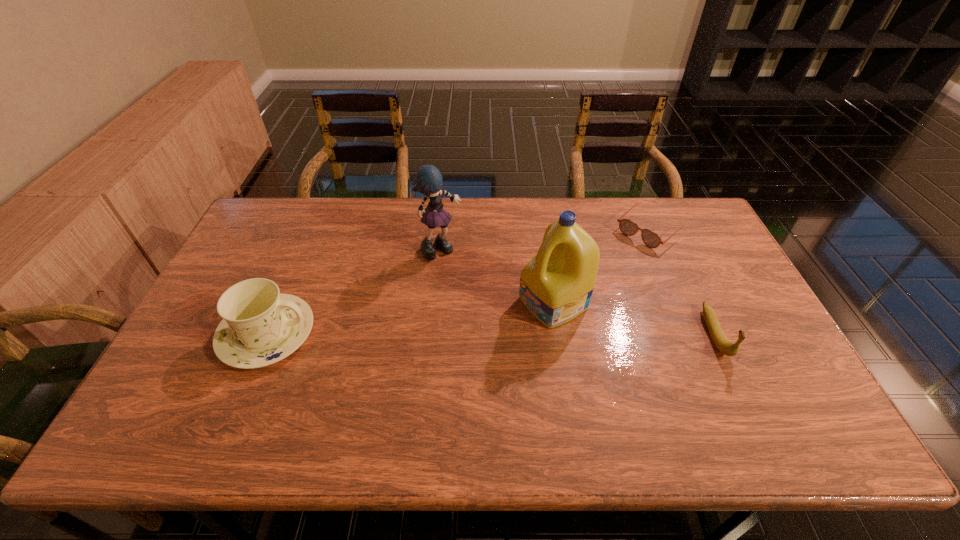
Where is `free region located 0.070m on the front-facing side of the sunglasses`? free region located 0.070m on the front-facing side of the sunglasses is located at coordinates (619, 256).

You are a GUI agent. You are given a task and a screenshot of the screen. Output one action in this format:
    pyautogui.click(x=<x>, y=<y>)
    Task: Click on the vacant region located 0.340m on the label of the third object from left to right
    The image size is (960, 540).
    Given the screenshot: What is the action you would take?
    pyautogui.click(x=418, y=373)

The height and width of the screenshot is (540, 960). I want to click on vacant space located on the label of the third object from left to right, so click(x=477, y=342).

Image resolution: width=960 pixels, height=540 pixels. I want to click on free space located 0.200m on the label of the third object from left to right, so click(465, 349).

Find the location of a particular element. vacant space located on the front-facing side of the fourth object from right to left is located at coordinates (499, 297).

At what (x,y) coordinates should I click in order to perform the action: click on vacant area located on the front-facing side of the fourth object from right to left. Please return your answer as a coordinate pair (x, y). This screenshot has height=540, width=960. Looking at the image, I should click on (495, 293).

Locate an element on the screen. This screenshot has width=960, height=540. vacant space situated 0.310m on the front-facing side of the fourth object from right to left is located at coordinates (520, 315).

The height and width of the screenshot is (540, 960). Identify the location of object located at the far edge. (651, 239).

Where is `object that is at the near edge`? object that is at the near edge is located at coordinates tap(261, 326).

The width and height of the screenshot is (960, 540). What are the coordinates of `object at the left edge` in the screenshot? It's located at (261, 326).